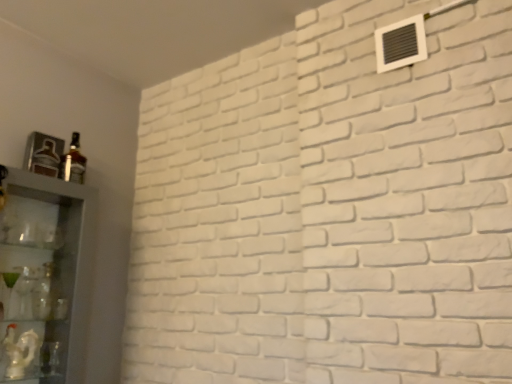
Question: From a real-world perspective, is clear glass cabinet at left, marked as the 2th shelf in a bottom-to-top arrangement, on top of matte glass bottle at left?

Choices:
 (A) no
 (B) yes

Answer: (A)

Question: Does clear glass cabinet at left, marked as the 2th shelf in a bottom-to-top arrangement, have a larger size compared to matte glass bottle at left?

Choices:
 (A) yes
 (B) no

Answer: (A)

Question: Is clear glass cabinet at left, positioned as the 1th shelf in top-to-bottom order, positioned with its back to matte glass bottle at left?

Choices:
 (A) no
 (B) yes

Answer: (A)

Question: From the image's perspective, would you say clear glass cabinet at left, positioned as the 1th shelf in top-to-bottom order, is shown under matte glass bottle at left?

Choices:
 (A) yes
 (B) no

Answer: (A)

Question: Can you confirm if clear glass cabinet at left, marked as the 2th shelf in a bottom-to-top arrangement, is smaller than matte glass bottle at left?

Choices:
 (A) no
 (B) yes

Answer: (A)

Question: Considering the relative sizes of clear glass cabinet at left, marked as the 2th shelf in a bottom-to-top arrangement, and matte glass bottle at left in the image provided, is clear glass cabinet at left, marked as the 2th shelf in a bottom-to-top arrangement, wider than matte glass bottle at left?

Choices:
 (A) yes
 (B) no

Answer: (A)

Question: From a real-world perspective, is matte glass bottle at left beneath white glossy statue at lower left, which ranks as the 2th shelf in top-to-bottom order?

Choices:
 (A) yes
 (B) no

Answer: (B)

Question: Does matte glass bottle at left have a greater height compared to white glossy statue at lower left, marked as the first shelf in a bottom-to-top arrangement?

Choices:
 (A) yes
 (B) no

Answer: (A)

Question: Is the position of matte glass bottle at left less distant than that of white glossy statue at lower left, which ranks as the 2th shelf in top-to-bottom order?

Choices:
 (A) yes
 (B) no

Answer: (B)

Question: Is matte glass bottle at left far away from white glossy statue at lower left, which ranks as the 2th shelf in top-to-bottom order?

Choices:
 (A) yes
 (B) no

Answer: (B)

Question: Does matte glass bottle at left have a lesser width compared to white glossy statue at lower left, marked as the first shelf in a bottom-to-top arrangement?

Choices:
 (A) yes
 (B) no

Answer: (B)

Question: Is matte glass bottle at left wider than white glossy statue at lower left, marked as the first shelf in a bottom-to-top arrangement?

Choices:
 (A) no
 (B) yes

Answer: (B)

Question: Can you confirm if matte glass bottle at left is wider than white plastic air conditioning unit at upper right?

Choices:
 (A) yes
 (B) no

Answer: (A)